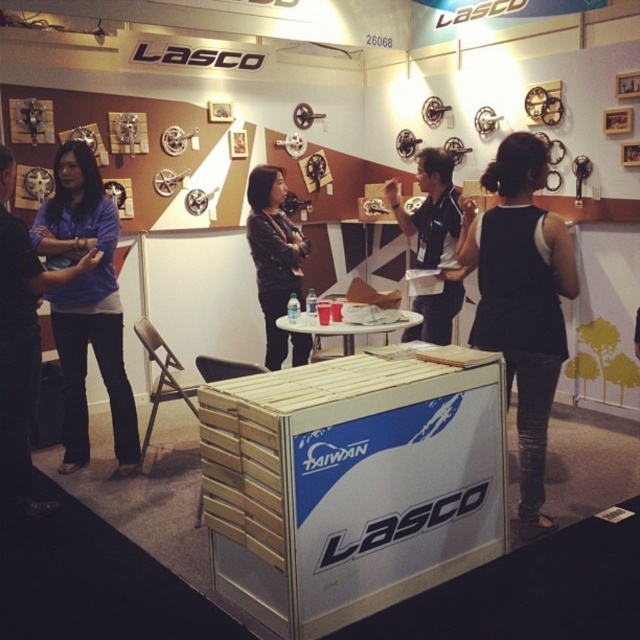
Does matte blue shirt at left have a smaller size compared to black leather jacket at center?

No, matte blue shirt at left is not smaller than black leather jacket at center.

Does matte blue shirt at left have a larger size compared to black leather jacket at center?

Indeed, matte blue shirt at left has a larger size compared to black leather jacket at center.

You are a GUI agent. You are given a task and a screenshot of the screen. Output one action in this format:
    pyautogui.click(x=<x>, y=<y>)
    Task: Click on the matte blue shirt at left
    This screenshot has width=640, height=640.
    Given the screenshot: What is the action you would take?
    pyautogui.click(x=84, y=304)

Is matte blue shirt at left wider than black shirt at center?

Indeed, matte blue shirt at left has a greater width compared to black shirt at center.

You are a GUI agent. You are given a task and a screenshot of the screen. Output one action in this format:
    pyautogui.click(x=<x>, y=<y>)
    Task: Click on the matte blue shirt at left
    The image size is (640, 640).
    Given the screenshot: What is the action you would take?
    pyautogui.click(x=84, y=304)

The image size is (640, 640). Identify the location of matte blue shirt at left. (84, 304).

Consider the image. Which is below, black fabric dress at center or black leather jacket at center?

black fabric dress at center is lower down.

Can you confirm if black fabric dress at center is positioned to the right of black leather jacket at center?

Correct, you'll find black fabric dress at center to the right of black leather jacket at center.

Identify the location of black fabric dress at center. The image size is (640, 640). (522, 300).

Identify the location of black fabric dress at center. This screenshot has height=640, width=640. (522, 300).